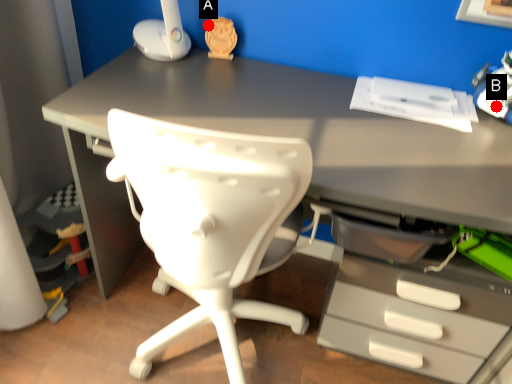
Question: Two points are circled on the image, labeled by A and B beside each circle. Which of the following is the farthest from the observer?

Choices:
 (A) A is further
 (B) B is further

Answer: (A)